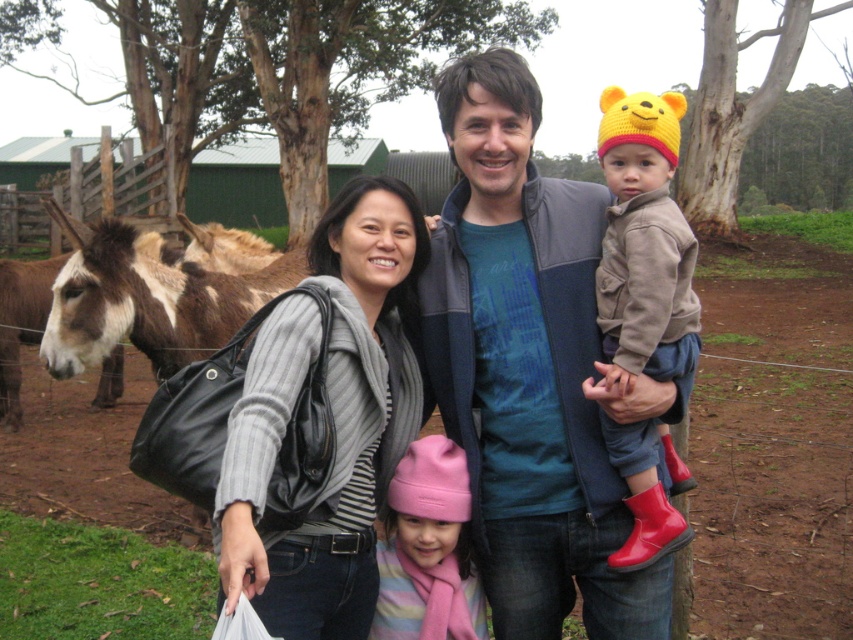
Does point (473, 269) come farther from viewer compared to point (399, 561)?

No, (473, 269) is closer to viewer.

Describe the element at coordinates (531, 368) in the screenshot. I see `blue fleece jacket at center` at that location.

Find the location of `blue fleece jacket at center`. blue fleece jacket at center is located at coordinates (531, 368).

Can you confirm if gray woolen sweater at center is wider than brown fuzzy donkey at left?

No, gray woolen sweater at center is not wider than brown fuzzy donkey at left.

Which is behind, point (302, 621) or point (74, 340)?

Point (74, 340)

Identify the location of gray woolen sweater at center. (332, 413).

Can you confirm if blue fleece jacket at center is positioned to the right of brown fuzzy donkey at left?

Indeed, blue fleece jacket at center is positioned on the right side of brown fuzzy donkey at left.

Between point (462, 292) and point (85, 364), which one is positioned behind?

The point (85, 364) is behind.

Which is behind, point (564, 410) or point (223, 342)?

The point (223, 342) is more distant.

You are a GUI agent. You are given a task and a screenshot of the screen. Output one action in this format:
    pyautogui.click(x=<x>, y=<y>)
    Task: Click on the blue fleece jacket at center
    This screenshot has width=853, height=640.
    Given the screenshot: What is the action you would take?
    pyautogui.click(x=531, y=368)